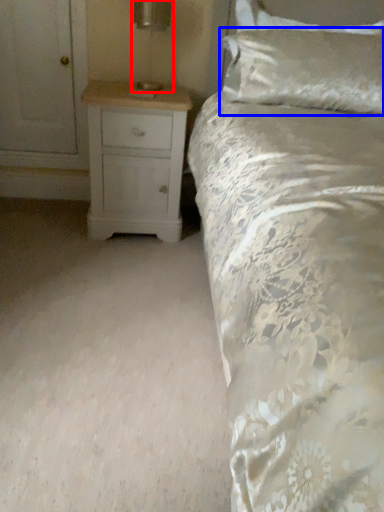
Question: Which point is closer to the camera, table lamp (highlighted by a red box) or pillow (highlighted by a blue box)?

Choices:
 (A) table lamp
 (B) pillow

Answer: (A)